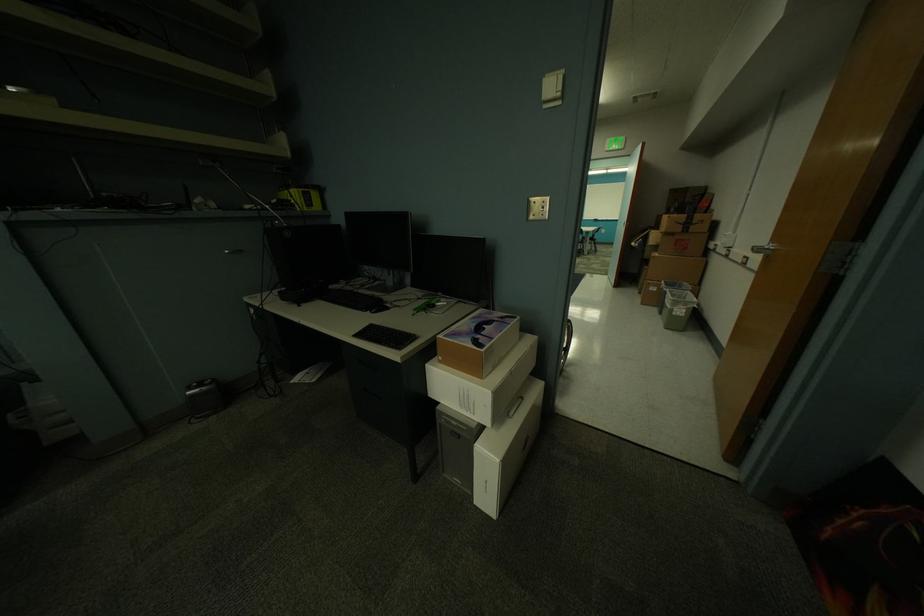
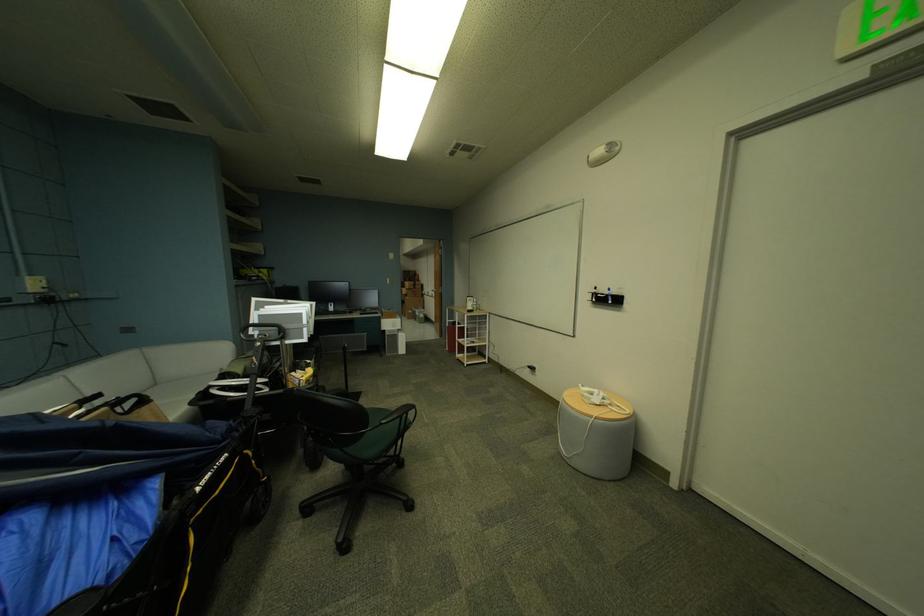
Where in the second image is the point corresponding to the point at 694,217 from the first image?

(421, 284)